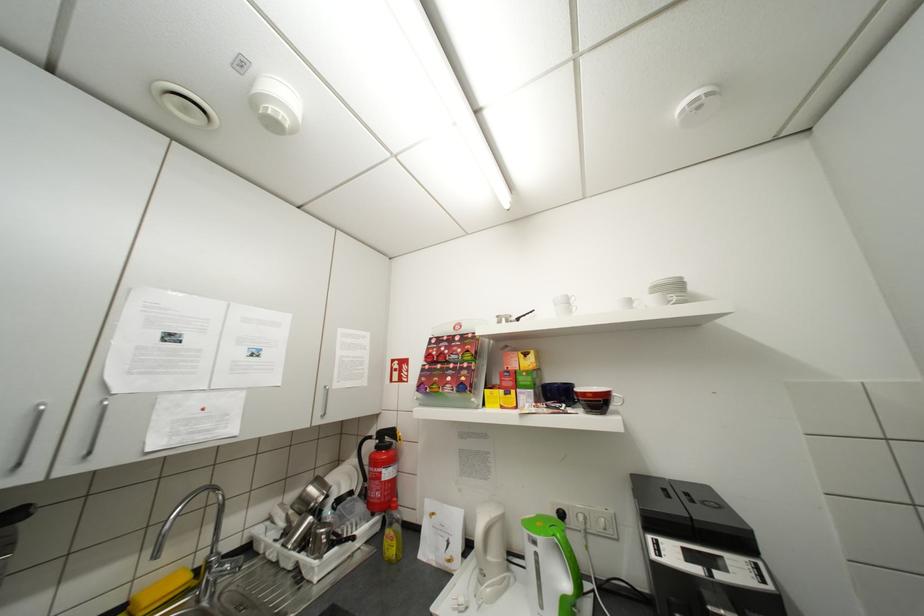
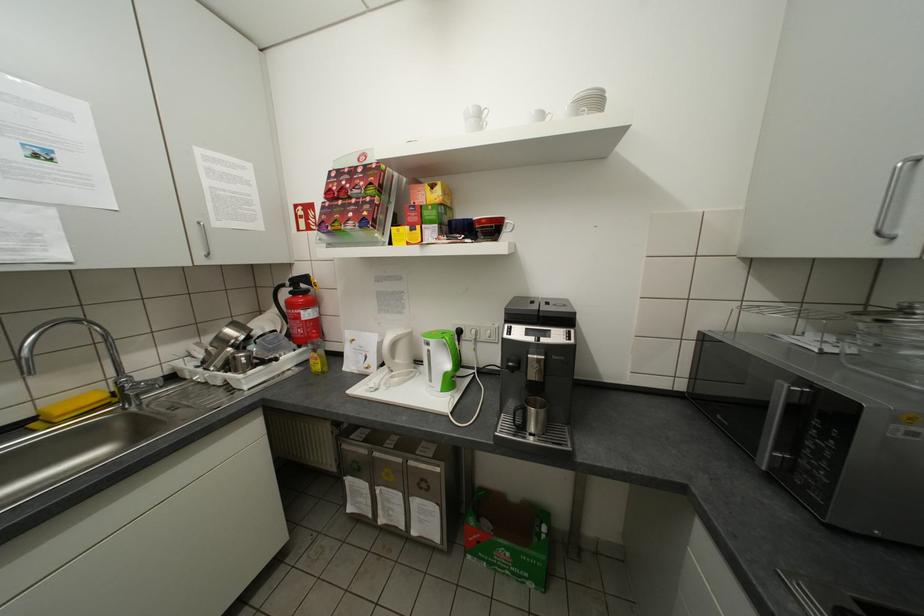
The point at [638,302] is marked in the first image. Where is the corresponding point in the second image?

(551, 116)